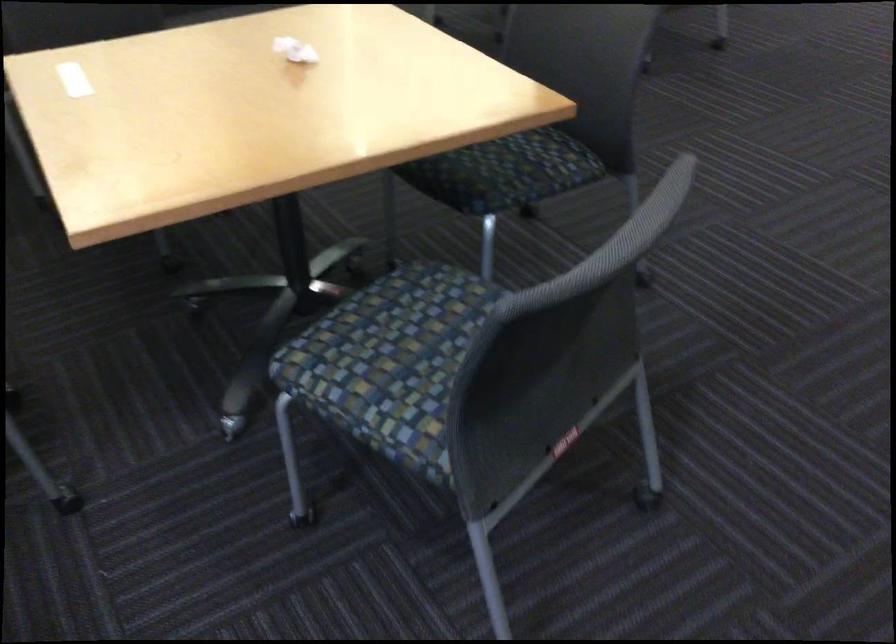
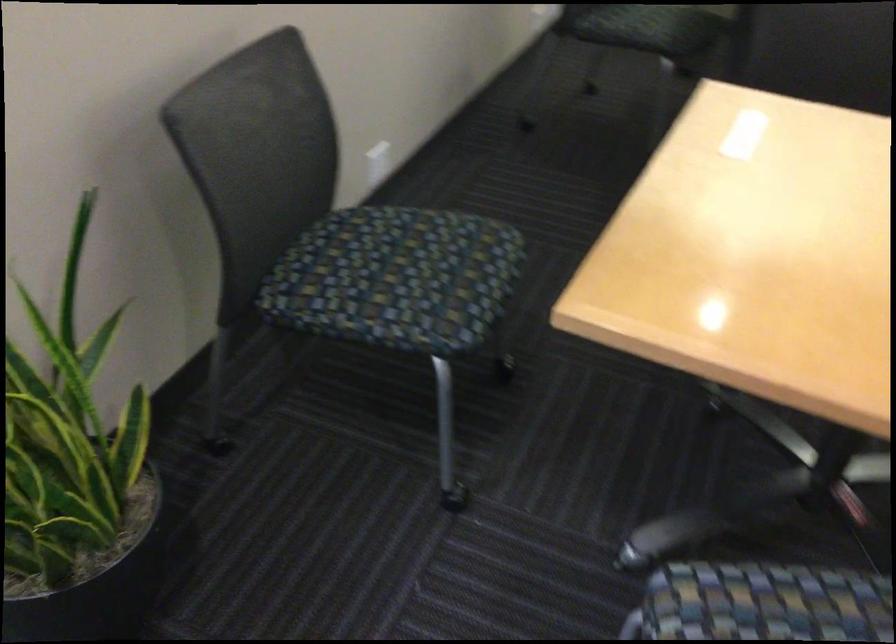
Question: The first image is from the beginning of the video and the second image is from the end. How did the camera likely rotate when shooting the video?

Choices:
 (A) Left
 (B) Right
 (C) Up
 (D) Down

Answer: (A)